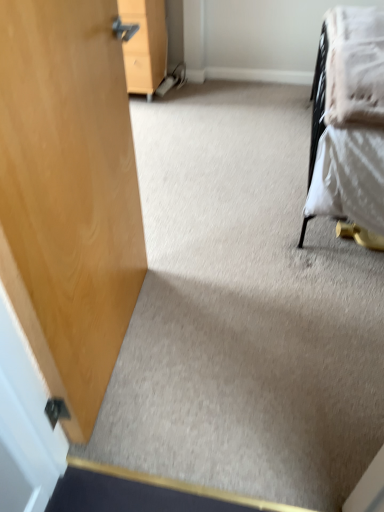
Question: Would you say wooden cabinet at upper left is inside or outside white soft blanket at upper right?

Choices:
 (A) outside
 (B) inside

Answer: (A)

Question: Is point (162, 6) positioned closer to the camera than point (354, 69)?

Choices:
 (A) farther
 (B) closer

Answer: (A)

Question: Is wooden cabinet at upper left bigger or smaller than white soft blanket at upper right?

Choices:
 (A) small
 (B) big

Answer: (B)

Question: Does point (349, 24) appear closer or farther from the camera than point (142, 90)?

Choices:
 (A) closer
 (B) farther

Answer: (A)

Question: From the image's perspective, relative to wooden cabinet at upper left, is white soft blanket at upper right above or below?

Choices:
 (A) below
 (B) above

Answer: (A)

Question: From a real-world perspective, is white soft blanket at upper right above or below wooden cabinet at upper left?

Choices:
 (A) below
 (B) above

Answer: (B)

Question: Is white soft blanket at upper right bigger or smaller than wooden cabinet at upper left?

Choices:
 (A) big
 (B) small

Answer: (B)